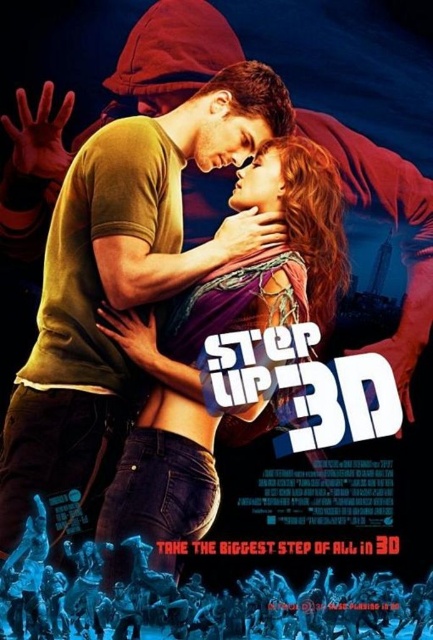
Can you confirm if matte yellow t-shirt at center is thinner than matte black jeans at lower left?

Indeed, matte yellow t-shirt at center has a lesser width compared to matte black jeans at lower left.

Locate an element on the screen. The width and height of the screenshot is (433, 640). matte yellow t-shirt at center is located at coordinates (203, 344).

Is point (280, 307) positioned in front of point (312, 608)?

No, (280, 307) is further to viewer.

The width and height of the screenshot is (433, 640). I want to click on matte yellow t-shirt at center, so click(x=203, y=344).